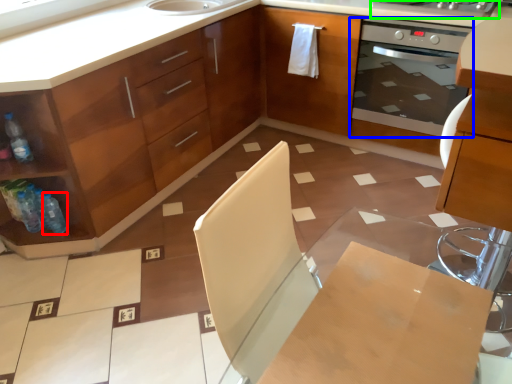
Question: Which object is the farthest from bottle (highlighted by a red box)? Choose among these: home appliance (highlighted by a blue box) or kitchen appliance (highlighted by a green box).

Choices:
 (A) home appliance
 (B) kitchen appliance

Answer: (B)